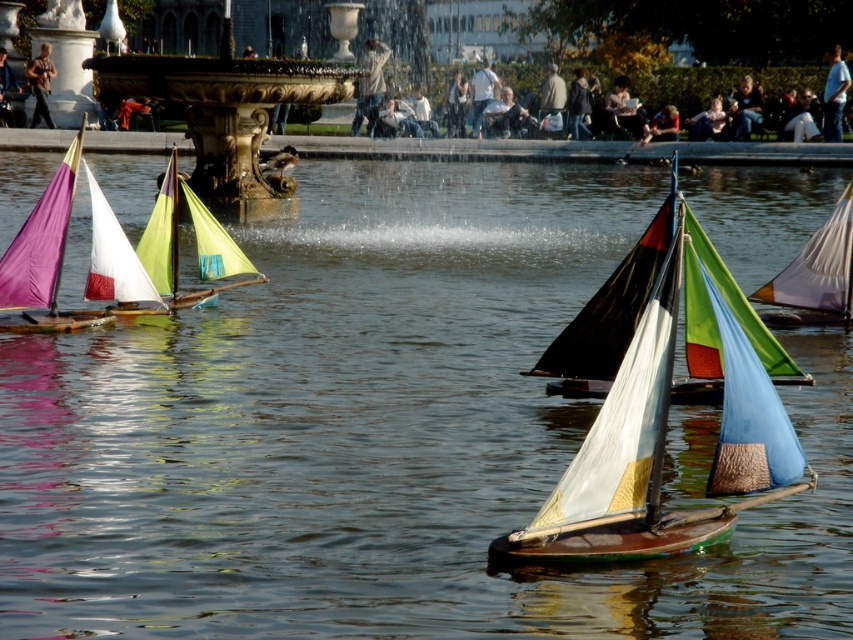
Question: Which of the following is the closest to the observer?

Choices:
 (A) (115, 72)
 (B) (96, 237)

Answer: (B)

Question: Can you confirm if matte black sailboat at center is smaller than matte purple sailboat at left?

Choices:
 (A) no
 (B) yes

Answer: (B)

Question: Which object is positioned farthest from the matte black sailboat at center?

Choices:
 (A) gold ornate fountain at upper center
 (B) matte purple sailboat at left

Answer: (A)

Question: Can you confirm if matte black sailboat at center is positioned above matte purple sailboat at left?

Choices:
 (A) no
 (B) yes

Answer: (A)

Question: Can you confirm if matte black sailboat at center is thinner than matte purple sailboat at left?

Choices:
 (A) yes
 (B) no

Answer: (A)

Question: Which point is closer to the camera?

Choices:
 (A) gold ornate fountain at upper center
 (B) matte black sailboat at center

Answer: (B)